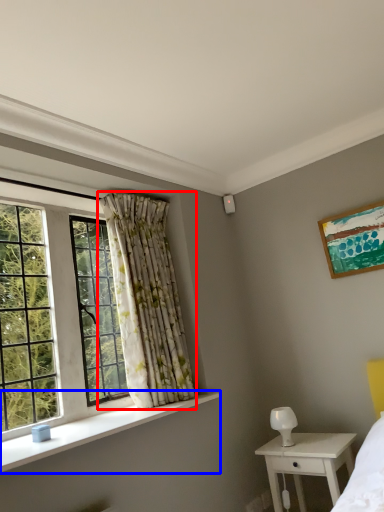
Question: Which object is closer to the camera taking this photo, curtain (highlighted by a red box) or window sill (highlighted by a blue box)?

Choices:
 (A) curtain
 (B) window sill

Answer: (B)